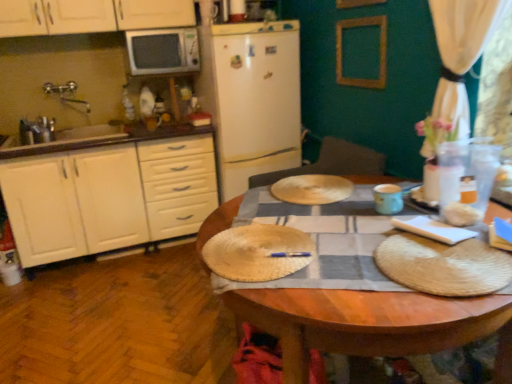
I want to click on free space to the right of bamboo placemat at center, so click(364, 246).